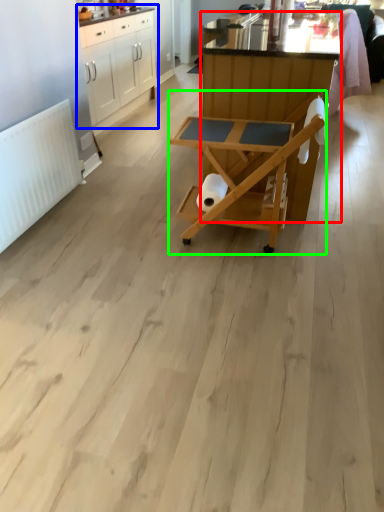
Question: Which is nearer to the table (highlighted by a red box)? cabinetry (highlighted by a blue box) or table (highlighted by a green box).

Choices:
 (A) cabinetry
 (B) table

Answer: (B)